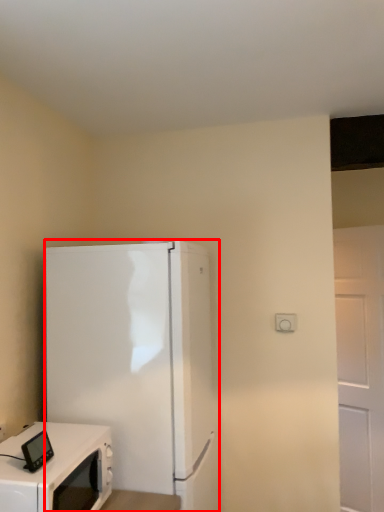
Question: Observing the image, what is the correct spatial positioning of refrigerator (annotated by the red box) in reference to home appliance?

Choices:
 (A) right
 (B) left

Answer: (A)